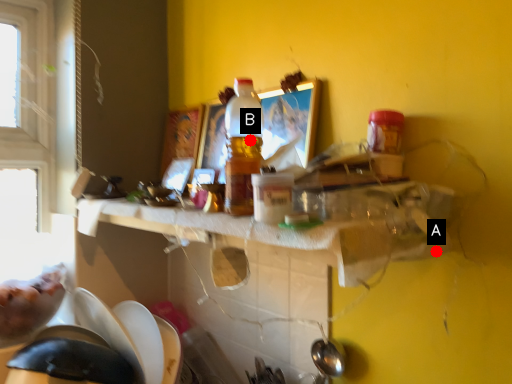
Question: Two points are circled on the image, labeled by A and B beside each circle. Among these points, which one is nearest to the camera?

Choices:
 (A) A is closer
 (B) B is closer

Answer: (B)